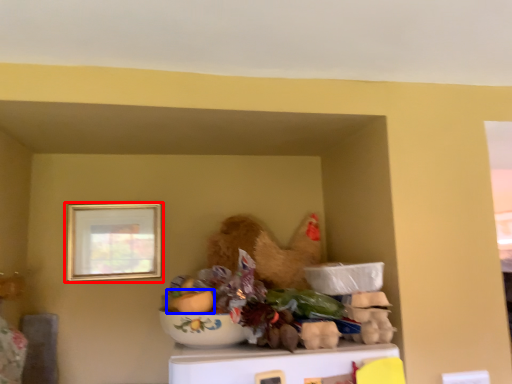
Question: Which of the following is the farthest to the observer, picture frame (highlighted by a red box) or food (highlighted by a blue box)?

Choices:
 (A) picture frame
 (B) food

Answer: (A)